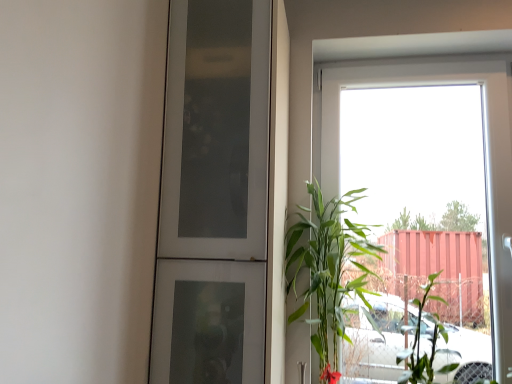
Question: Could you tell me if green leafy plant at right is turned towards green leafy plant at right?

Choices:
 (A) no
 (B) yes

Answer: (A)

Question: Would you say green leafy plant at right is outside green leafy plant at right?

Choices:
 (A) no
 (B) yes

Answer: (B)

Question: Is green leafy plant at right located within green leafy plant at right?

Choices:
 (A) yes
 (B) no

Answer: (B)

Question: Is green leafy plant at right wider than green leafy plant at right?

Choices:
 (A) yes
 (B) no

Answer: (A)

Question: Can you confirm if green leafy plant at right is taller than green leafy plant at right?

Choices:
 (A) yes
 (B) no

Answer: (A)

Question: From the image's perspective, is green leafy plant at right under green leafy plant at right?

Choices:
 (A) no
 (B) yes

Answer: (A)

Question: Can we say green leafy plant at right lies outside green leafy plant at right?

Choices:
 (A) yes
 (B) no

Answer: (A)

Question: Is green leafy plant at right at the back of green leafy plant at right?

Choices:
 (A) no
 (B) yes

Answer: (A)

Question: From a real-world perspective, is green leafy plant at right over green leafy plant at right?

Choices:
 (A) yes
 (B) no

Answer: (B)

Question: From the image's perspective, is green leafy plant at right located beneath green leafy plant at right?

Choices:
 (A) no
 (B) yes

Answer: (B)

Question: Considering the relative sizes of green leafy plant at right and green leafy plant at right in the image provided, is green leafy plant at right bigger than green leafy plant at right?

Choices:
 (A) yes
 (B) no

Answer: (B)

Question: From the image's perspective, is green leafy plant at right over green leafy plant at right?

Choices:
 (A) no
 (B) yes

Answer: (A)

Question: Is green leafy plant at right not near transparent glass window at upper right?

Choices:
 (A) no
 (B) yes

Answer: (A)